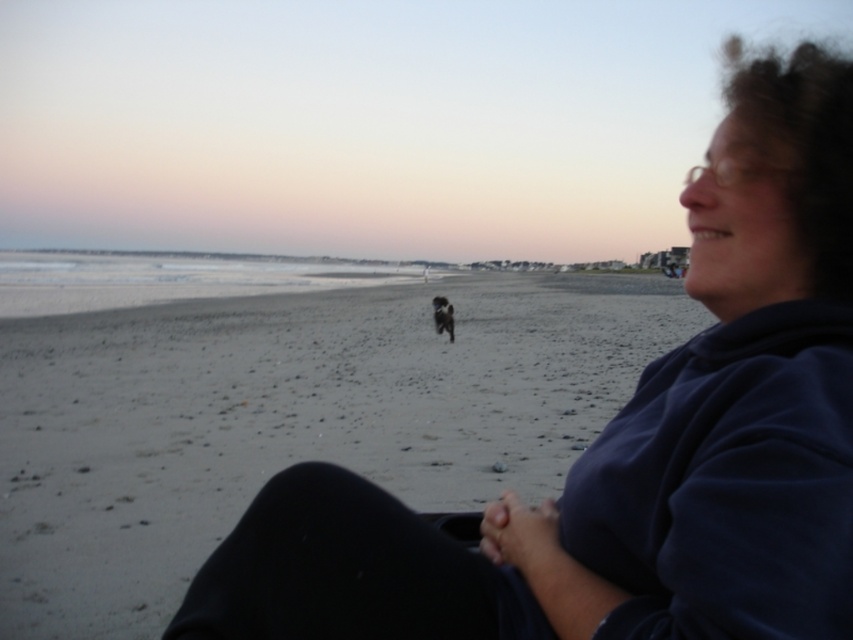
Question: From the image, what is the correct spatial relationship of gray sand at center in relation to black fur dog at center?

Choices:
 (A) left
 (B) right

Answer: (B)

Question: Does gray sand at center have a smaller size compared to black fur dog at center?

Choices:
 (A) yes
 (B) no

Answer: (B)

Question: Among these points, which one is nearest to the camera?

Choices:
 (A) (438, 298)
 (B) (3, 465)

Answer: (B)

Question: Is gray sand at center further to the viewer compared to black fur dog at center?

Choices:
 (A) no
 (B) yes

Answer: (A)

Question: Among these points, which one is farthest from the camera?

Choices:
 (A) (45, 595)
 (B) (440, 300)

Answer: (B)